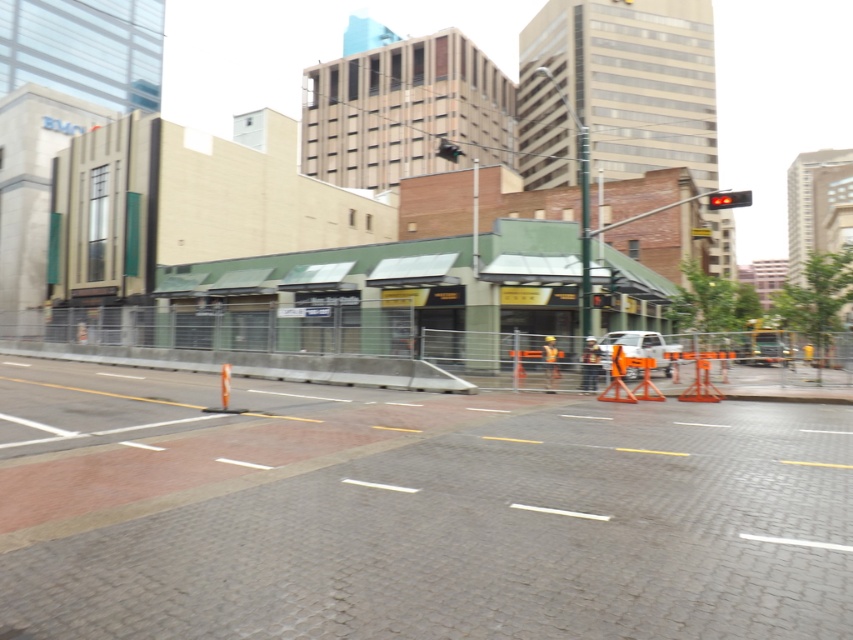
You are a delivery driver who needs to park your truck, which is 15 feet long, in the construction area. Can you fit the white matte truck at center between the red plastic traffic light at center and the nearest barrier without overlapping them?

The distance between the white matte truck at center and the red plastic traffic light at center is 14.36 feet. Since the truck is 15 feet long, it cannot fit in the space as it would overlap with either the traffic light or the barrier.